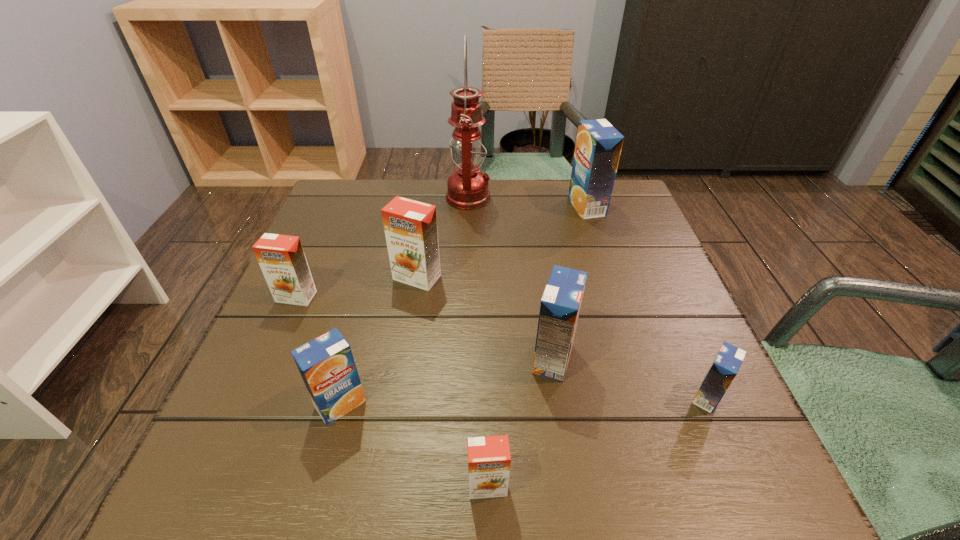
Locate an element on the screen. The height and width of the screenshot is (540, 960). free space located on the back of the smallest blue orange_juice is located at coordinates (686, 349).

You are a GUI agent. You are given a task and a screenshot of the screen. Output one action in this format:
    pyautogui.click(x=<x>, y=<y>)
    Task: Click on the vacant space located on the back of the nearest orange orange juice
    This screenshot has width=960, height=540.
    Given the screenshot: What is the action you would take?
    pyautogui.click(x=487, y=441)

The image size is (960, 540). I want to click on oil lamp that is at the far edge, so click(467, 187).

Image resolution: width=960 pixels, height=540 pixels. I want to click on orange_juice located in the far edge section of the desktop, so click(598, 147).

The height and width of the screenshot is (540, 960). What are the coordinates of `object present at the near edge` in the screenshot? It's located at (489, 458).

Find the location of a particular element. This screenshot has height=540, width=960. object positioned at the far right corner is located at coordinates (598, 147).

The height and width of the screenshot is (540, 960). I want to click on vacant region at the far edge, so click(543, 221).

Image resolution: width=960 pixels, height=540 pixels. What are the coordinates of `blank space at the left edge of the desktop` in the screenshot? It's located at (274, 370).

Image resolution: width=960 pixels, height=540 pixels. Identify the location of free location at the right edge. (629, 256).

The width and height of the screenshot is (960, 540). What are the coordinates of `free space at the far left corner` in the screenshot? It's located at (332, 217).